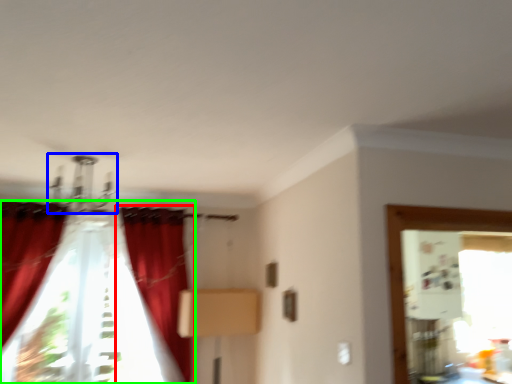
Question: Estimate the real-world distances between objects in this image. Which object is closer to curtain (highlighted by a red box), light fixture (highlighted by a blue box) or curtain (highlighted by a green box)?

Choices:
 (A) light fixture
 (B) curtain

Answer: (B)